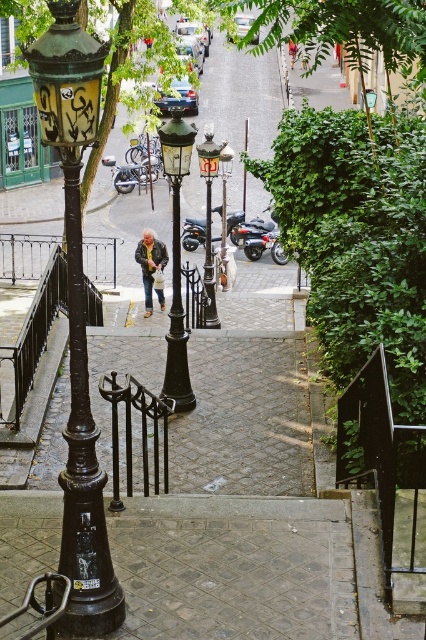
Which is behind, point (20, 262) or point (63, 588)?

The point (20, 262) is more distant.

Which is in front, point (31, 237) or point (28, 636)?

Point (28, 636) is in front.

Where is `black metal/rail at lower left`? This screenshot has width=426, height=640. black metal/rail at lower left is located at coordinates (25, 253).

Can you confirm if polished brass streetlight at center is positioned to the right of black glass street light at center?

Incorrect, polished brass streetlight at center is not on the right side of black glass street light at center.

Is polished brass streetlight at center taller than black glass street light at center?

No, polished brass streetlight at center is not taller than black glass street light at center.

Who is more distant from viewer, [203,168] or [222,209]?

Positioned behind is point [222,209].

Locate an element on the screen. The image size is (426, 640). polished brass streetlight at center is located at coordinates (209, 218).

Between green glass street light at center and polished brass streetlight at center, which one has more height?

Standing taller between the two is polished brass streetlight at center.

Which is more to the right, green glass street light at center or polished brass streetlight at center?

polished brass streetlight at center

Find the location of `green glass street light at center`. green glass street light at center is located at coordinates (176, 260).

Find the location of `green glass street light at center`. green glass street light at center is located at coordinates click(x=176, y=260).